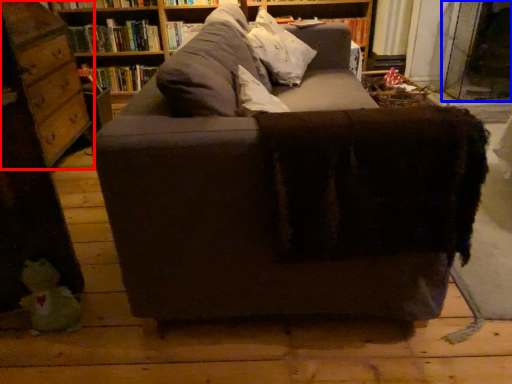
Question: Among these objects, which one is nearest to the camera, shelf (highlighted by a red box) or glass door (highlighted by a blue box)?

Choices:
 (A) shelf
 (B) glass door

Answer: (A)